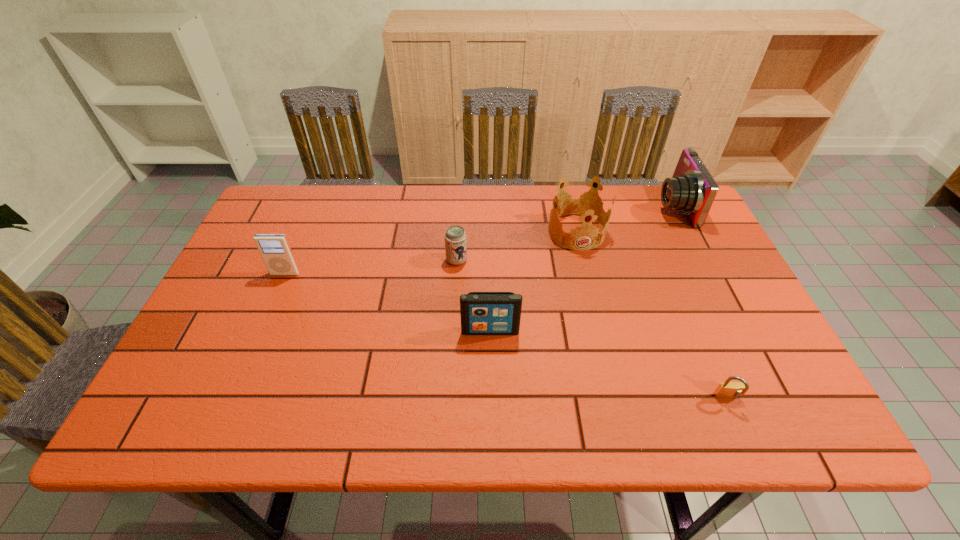
At what (x,y) coordinates should I click in order to perform the action: click on object at the near edge. Please return your answer as a coordinate pair (x, y). Image resolution: width=960 pixels, height=540 pixels. Looking at the image, I should click on (726, 390).

At what (x,y) coordinates should I click in order to perform the action: click on object that is at the left edge. Please return your answer as a coordinate pair (x, y). Looking at the image, I should click on (274, 249).

The width and height of the screenshot is (960, 540). I want to click on camera present at the right edge, so click(692, 189).

This screenshot has width=960, height=540. Find the location of `padlock located at the right edge`. padlock located at the right edge is located at coordinates (726, 390).

Image resolution: width=960 pixels, height=540 pixels. I want to click on object that is at the far right corner, so click(x=692, y=189).

Identify the location of object present at the near right corner. (726, 390).

Where is `vacant area at the far edge of the desktop`? The width and height of the screenshot is (960, 540). vacant area at the far edge of the desktop is located at coordinates click(532, 187).

Find the location of a particular element. This screenshot has width=960, height=540. free space at the near edge is located at coordinates click(x=354, y=400).

I want to click on blank area at the left edge, so click(278, 279).

In the image, there is a desktop. Find the location of `free space at the right edge`. free space at the right edge is located at coordinates (706, 300).